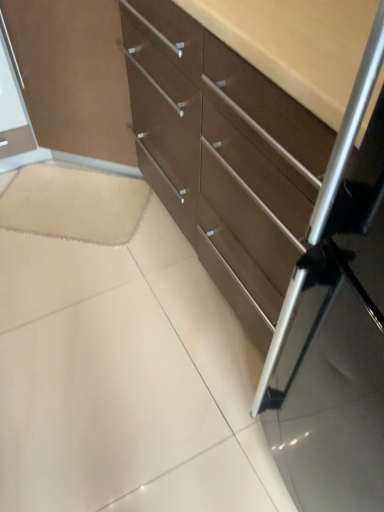
Question: Can you confirm if matte brown chest of drawers at center is thinner than beige soft carpet at lower left?

Choices:
 (A) no
 (B) yes

Answer: (A)

Question: Considering the relative positions of matte brown chest of drawers at center and beige soft carpet at lower left in the image provided, is matte brown chest of drawers at center to the left of beige soft carpet at lower left from the viewer's perspective?

Choices:
 (A) no
 (B) yes

Answer: (A)

Question: Can beige soft carpet at lower left be found inside matte brown chest of drawers at center?

Choices:
 (A) no
 (B) yes

Answer: (A)

Question: From a real-world perspective, does matte brown chest of drawers at center stand above beige soft carpet at lower left?

Choices:
 (A) no
 (B) yes

Answer: (B)

Question: Is matte brown chest of drawers at center oriented away from beige soft carpet at lower left?

Choices:
 (A) yes
 (B) no

Answer: (B)

Question: Considering the relative sizes of matte brown chest of drawers at center and beige soft carpet at lower left in the image provided, is matte brown chest of drawers at center bigger than beige soft carpet at lower left?

Choices:
 (A) yes
 (B) no

Answer: (A)

Question: Is beige soft carpet at lower left not near matte brown chest of drawers at center?

Choices:
 (A) yes
 (B) no

Answer: (B)

Question: Is beige soft carpet at lower left taller than matte brown chest of drawers at center?

Choices:
 (A) yes
 (B) no

Answer: (B)

Question: Is beige soft carpet at lower left looking in the opposite direction of matte brown chest of drawers at center?

Choices:
 (A) no
 (B) yes

Answer: (A)

Question: Does beige soft carpet at lower left appear on the right side of matte brown chest of drawers at center?

Choices:
 (A) yes
 (B) no

Answer: (B)

Question: Is beige soft carpet at lower left closer to the viewer compared to matte brown chest of drawers at center?

Choices:
 (A) no
 (B) yes

Answer: (A)

Question: From the image's perspective, is beige soft carpet at lower left below matte brown chest of drawers at center?

Choices:
 (A) yes
 (B) no

Answer: (A)

Question: Is beige soft carpet at lower left wider or thinner than matte brown chest of drawers at center?

Choices:
 (A) thin
 (B) wide

Answer: (A)